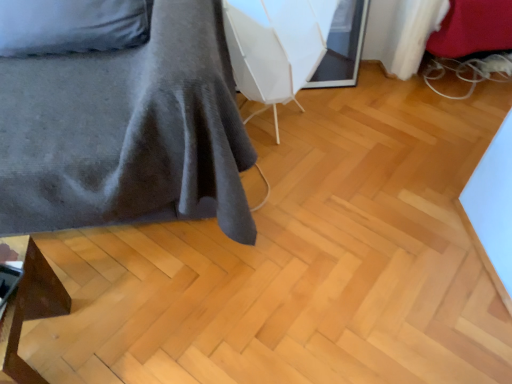
What are the coordinates of `free space between white plastic swivel chair at center and velvet grey bedspread at left, the 1th furniture in the top-to-bottom sequence` in the screenshot? It's located at (282, 184).